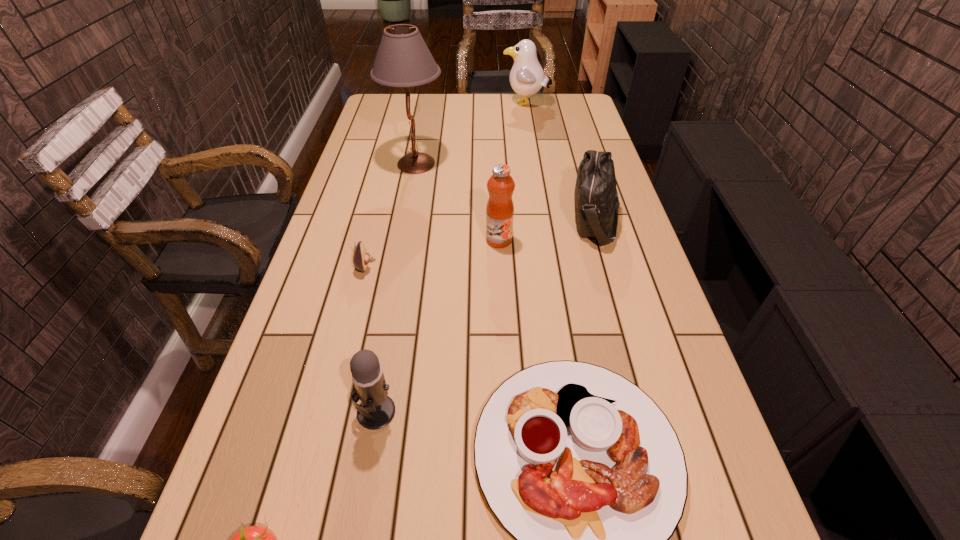
Where is `free spot between the gull and the shoulder bag`? free spot between the gull and the shoulder bag is located at coordinates (561, 162).

I want to click on vacant space that is in between the avocado and the microphone, so click(371, 338).

Find the location of a particular element. This screenshot has height=540, width=960. empty space between the second farthest object and the microphone is located at coordinates (396, 287).

Where is `object that is the second closest to the farthest object`? The width and height of the screenshot is (960, 540). object that is the second closest to the farthest object is located at coordinates (596, 199).

Select which object appears as the seventh closest to the platter. Please provide its 2D coordinates. Your answer should be formatted as a tuple, i.e. [(x, y)], where the tuple contains the x and y coordinates of a point satisfying the conditions above.

[(527, 77)]

At what (x,y) coordinates should I click in order to perform the action: click on free space that satisfies the following two spatial constraints: 1. on the seed side of the fifth farthest object; 2. on the back side of the microphone. Please return your answer as a coordinate pair (x, y). Looking at the image, I should click on (327, 411).